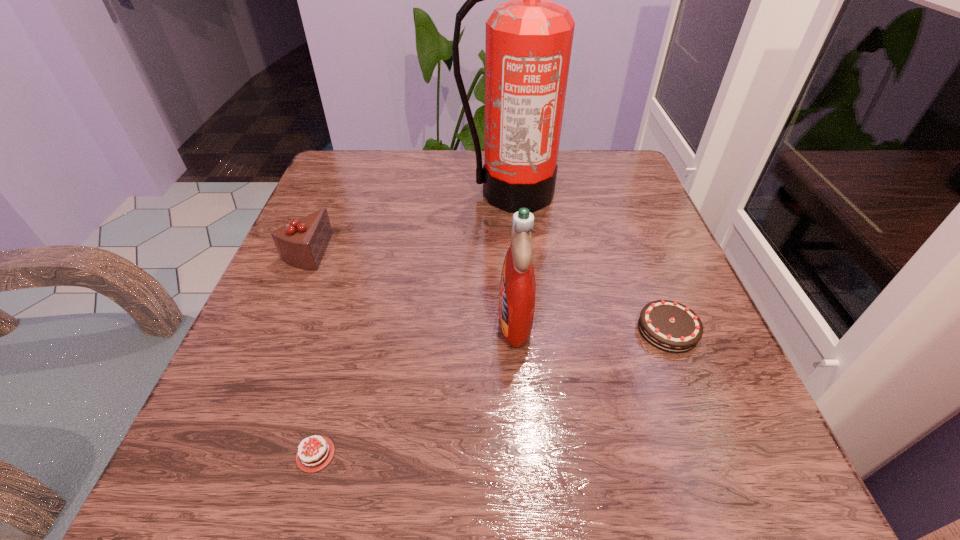
This screenshot has height=540, width=960. I want to click on blank space located 0.380m on the front surface of the second tallest object, so click(x=269, y=320).

You are a GUI agent. You are given a task and a screenshot of the screen. Output one action in this format:
    pyautogui.click(x=<x>, y=<y>)
    Task: Click on the vacant space situated 0.080m on the front surface of the second tallest object
    Image resolution: width=960 pixels, height=540 pixels.
    Given the screenshot: What is the action you would take?
    pyautogui.click(x=450, y=320)

Where is `free space located on the front surface of the second tallest object`? free space located on the front surface of the second tallest object is located at coordinates coord(390,320).

The width and height of the screenshot is (960, 540). In order to click on free space located 0.050m on the right of the tallest chocolate cake in this screenshot , I will do `click(352, 252)`.

Find the location of a particular element. Image resolution: width=960 pixels, height=540 pixels. vacant space located 0.200m on the front of the second tallest chocolate cake is located at coordinates (736, 504).

Image resolution: width=960 pixels, height=540 pixels. What are the coordinates of `blank area located 0.140m on the back of the shortest chocolate cake` in the screenshot? It's located at (349, 332).

Where is `object that is positioned at the far edge`? The width and height of the screenshot is (960, 540). object that is positioned at the far edge is located at coordinates (529, 39).

Find the location of a particular element. object that is at the near edge is located at coordinates (311, 458).

I want to click on object present at the right edge, so click(x=669, y=326).

At what (x,y) coordinates should I click in order to perform the action: click on object that is at the near left corner. Please return your answer as a coordinate pair (x, y). This screenshot has width=960, height=540. Looking at the image, I should click on [x=311, y=458].